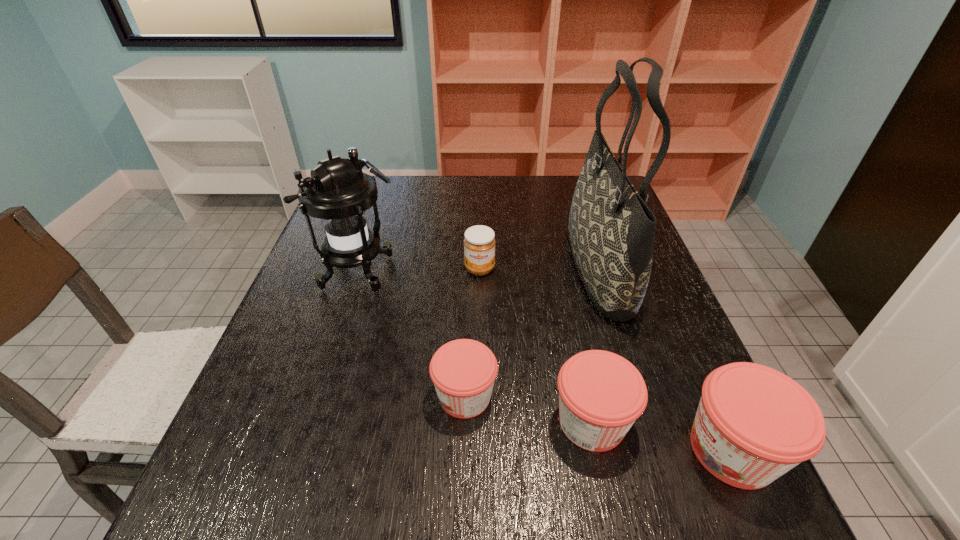
This screenshot has height=540, width=960. I want to click on blank space at the right edge, so click(x=649, y=321).

What are the coordinates of `vacant area between the third jam from left to right and the farthest jam` in the screenshot? It's located at (536, 345).

Locate an element on the screen. The height and width of the screenshot is (540, 960). free space between the second jam from right to left and the rightmost jam is located at coordinates (662, 436).

This screenshot has height=540, width=960. Find the location of `vacant space in between the second jam from right to left and the rightmost jam`. vacant space in between the second jam from right to left and the rightmost jam is located at coordinates (662, 436).

Where is `vacant region between the rightmost jam and the tallest object`? The image size is (960, 540). vacant region between the rightmost jam and the tallest object is located at coordinates (665, 359).

Image resolution: width=960 pixels, height=540 pixels. Identify the location of the fifth closest object to the second jam from right to left. (338, 192).

Locate which object ranks second in proximity to the farthest jam. Please provide its 2D coordinates. Your answer should be formatted as a tuple, i.e. [(x, y)], where the tuple contains the x and y coordinates of a point satisfying the conditions above.

[(611, 230)]

You are a GUI agent. You are given a task and a screenshot of the screen. Output one action in this format:
    pyautogui.click(x=<x>, y=<y>)
    Task: Click on the jam that is the fourth closest to the leftmost object
    This screenshot has width=960, height=540.
    Given the screenshot: What is the action you would take?
    pyautogui.click(x=753, y=424)

What are the coordinates of `jam that can be found as the second closest to the rightmost jam` in the screenshot? It's located at (463, 371).